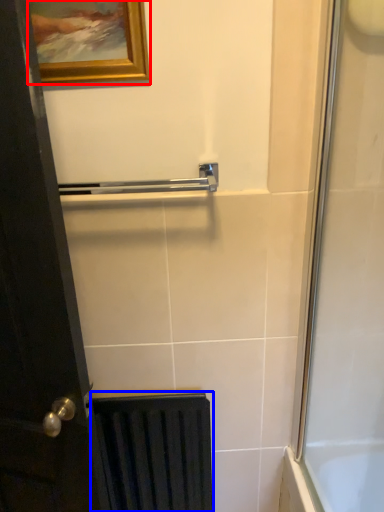
Question: Which point is closer to the camera, picture frame (highlighted by a red box) or radiator (highlighted by a blue box)?

Choices:
 (A) picture frame
 (B) radiator

Answer: (A)